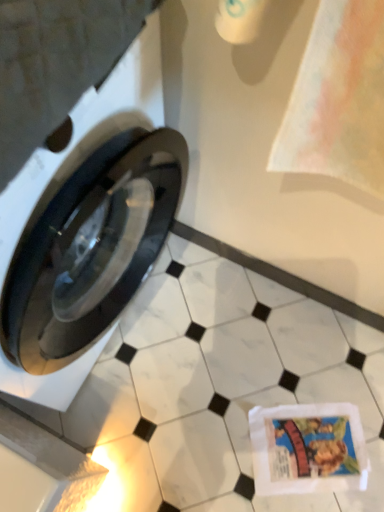
Describe the element at coordinates (77, 312) in the screenshot. I see `shiny black washing machine at left` at that location.

Measure the distance between shiny black washing machine at left and camera.

19.53 inches.

I want to click on shiny black washing machine at left, so [x=77, y=312].

At what (x,y) coordinates should I click in order to perform the action: click on shiny black washing machine at left. Please return your answer as a coordinate pair (x, y). Image resolution: width=384 pixels, height=512 pixels. Looking at the image, I should click on (77, 312).